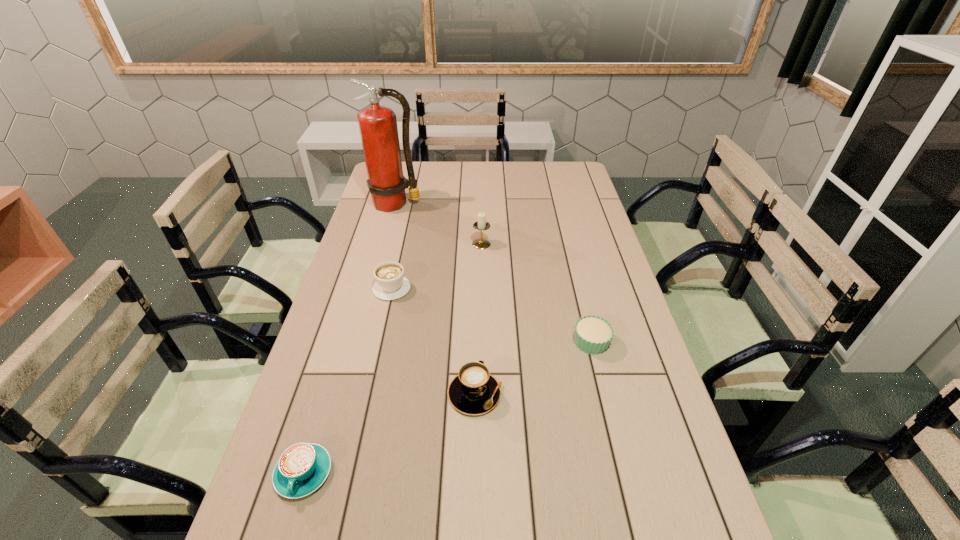
Locate an element on the screen. This screenshot has height=540, width=960. blank space that satisfies the following two spatial constraints: 1. on the front side of the fifth shortest object; 2. on the left side of the third nearest object is located at coordinates (482, 342).